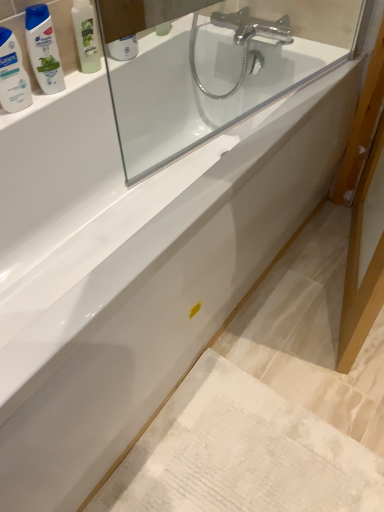
Question: From the image's perspective, would you say white textured bath mat at lower right is shown under green matte shampoo bottle at upper left?

Choices:
 (A) no
 (B) yes

Answer: (B)

Question: Is white textured bath mat at lower right looking in the opposite direction of green matte shampoo bottle at upper left?

Choices:
 (A) no
 (B) yes

Answer: (A)

Question: Is white textured bath mat at lower right beside green matte shampoo bottle at upper left?

Choices:
 (A) yes
 (B) no

Answer: (B)

Question: Can you confirm if white textured bath mat at lower right is taller than green matte shampoo bottle at upper left?

Choices:
 (A) yes
 (B) no

Answer: (B)

Question: Is white textured bath mat at lower right oriented towards green matte shampoo bottle at upper left?

Choices:
 (A) no
 (B) yes

Answer: (A)

Question: Is white textured bath mat at lower right positioned behind green matte shampoo bottle at upper left?

Choices:
 (A) no
 (B) yes

Answer: (A)

Question: From the image's perspective, would you say white glossy bottle at upper left is shown under green plastic mouthwash at upper left?

Choices:
 (A) no
 (B) yes

Answer: (B)

Question: Does white glossy bottle at upper left appear on the left side of green plastic mouthwash at upper left?

Choices:
 (A) yes
 (B) no

Answer: (A)

Question: Is there a large distance between white glossy bottle at upper left and green plastic mouthwash at upper left?

Choices:
 (A) yes
 (B) no

Answer: (B)

Question: Is white glossy bottle at upper left outside green plastic mouthwash at upper left?

Choices:
 (A) no
 (B) yes

Answer: (B)

Question: From a real-world perspective, is white glossy bottle at upper left located higher than green plastic mouthwash at upper left?

Choices:
 (A) no
 (B) yes

Answer: (A)

Question: Is green plastic mouthwash at upper left at the back of white glossy bottle at upper left?

Choices:
 (A) no
 (B) yes

Answer: (A)

Question: Is green matte shampoo bottle at upper left wider than white glossy bottle at upper left?

Choices:
 (A) no
 (B) yes

Answer: (A)